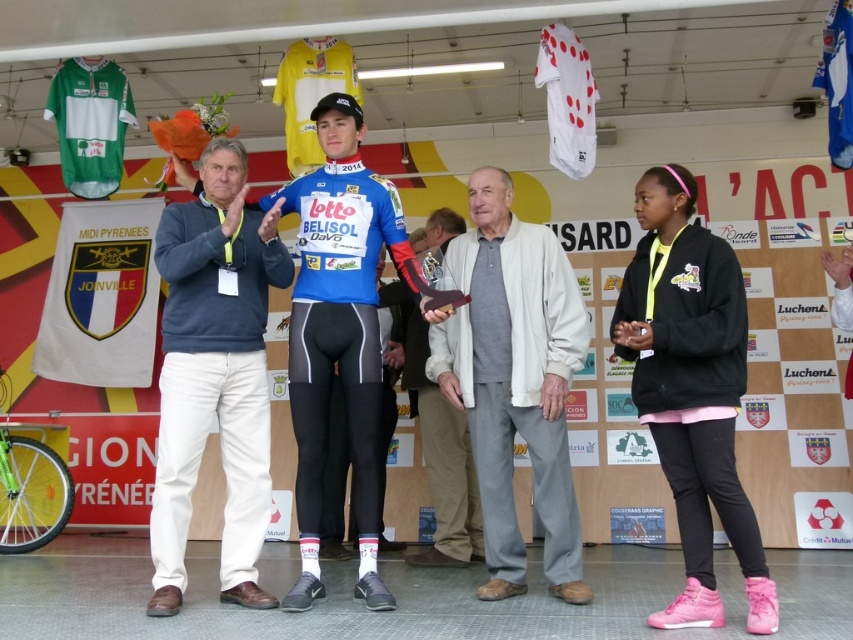
Question: Is white cotton jacket at center positioned in front of light gray wool sweater at center?

Choices:
 (A) yes
 (B) no

Answer: (A)

Question: In this image, where is white cotton jacket at center located relative to light gray wool sweater at center?

Choices:
 (A) above
 (B) below

Answer: (A)

Question: Which of the following is the closest to the observer?

Choices:
 (A) white cotton jacket at center
 (B) light gray wool sweater at center

Answer: (A)

Question: Among these objects, which one is farthest from the camera?

Choices:
 (A) white cotton jacket at center
 (B) light gray wool sweater at center

Answer: (B)

Question: Can you confirm if white cotton jacket at center is positioned to the right of light gray wool sweater at center?

Choices:
 (A) yes
 (B) no

Answer: (A)